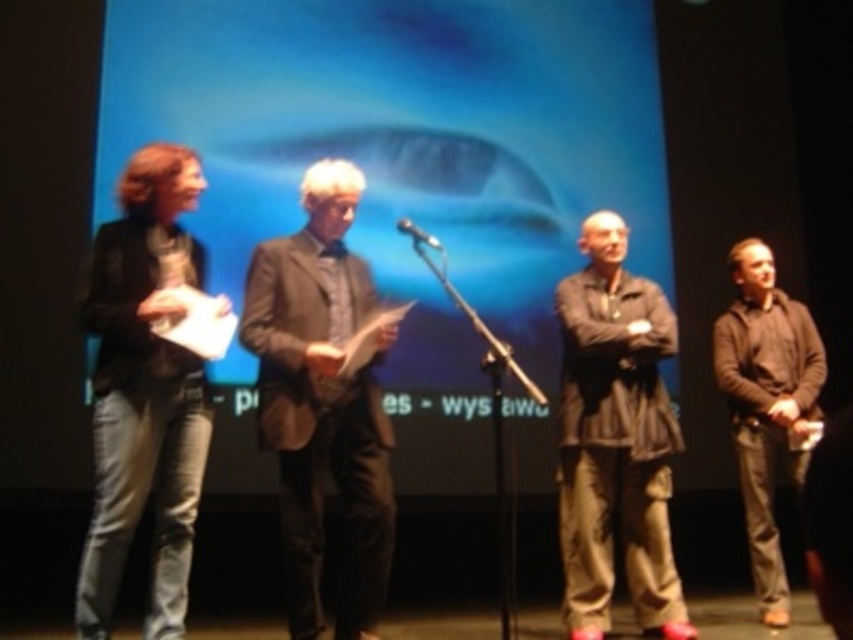
You are a stagehand who needs to place a 1.2 meter long banner between the brown textured suit at center and the dark gray fabric shirt at center. Can the banner fit between them without overlapping either?

The distance between the brown textured suit at center and the dark gray fabric shirt at center is 1.11 meters. Since the banner is 1.2 meters long, it cannot fit between them without overlapping either.

Consider the image. You are an event coordinator checking the stage setup. You notice the dark gray fabric shirt at center and the metallic silver microphone at center. Which object is wider from your viewpoint?

The dark gray fabric shirt at center is wider than the metallic silver microphone at center according to the description.

You are an event coordinator observing the stage setup. You need to adjust the lighting so that the dark gray fabric shirt at center is illuminated more than the brown cotton shirt at right. Based on their positions, which shirt is closer to the front of the stage?

The dark gray fabric shirt at center is in front of the brown cotton shirt at right, so it is closer to the front of the stage and should be illuminated more.